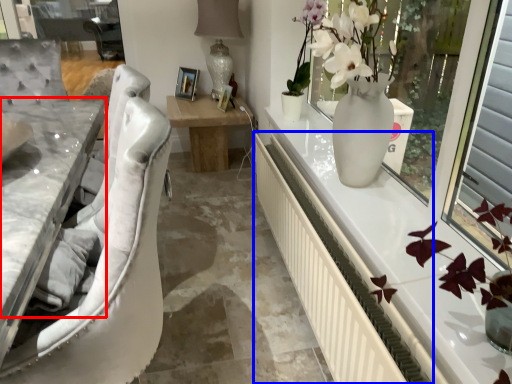
Question: Which of the following is the closest to the observer, counter top (highlighted by a red box) or radiator (highlighted by a blue box)?

Choices:
 (A) counter top
 (B) radiator

Answer: (A)